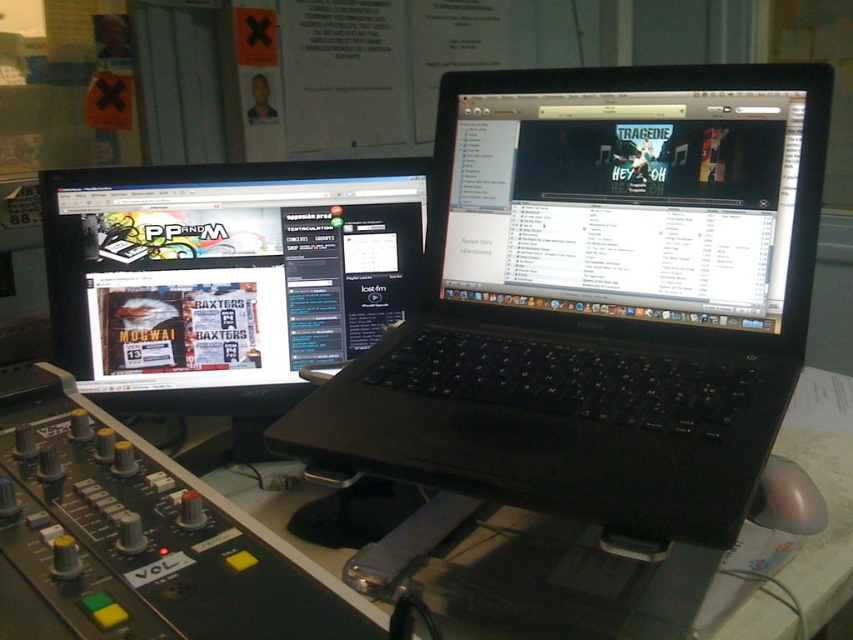
Is matte black monitor at left below black glossy laptop at upper center?

Indeed, matte black monitor at left is positioned under black glossy laptop at upper center.

The width and height of the screenshot is (853, 640). What do you see at coordinates (225, 275) in the screenshot? I see `matte black monitor at left` at bounding box center [225, 275].

Is point (408, 291) positioned in front of point (666, 253)?

No, (408, 291) is behind (666, 253).

Locate an element on the screen. This screenshot has height=640, width=853. matte black monitor at left is located at coordinates (225, 275).

Does black matte laptop at upper center have a larger size compared to matte black monitor at left?

Yes, black matte laptop at upper center is bigger than matte black monitor at left.

Is point (448, 400) positioned in front of point (212, 205)?

Yes.

This screenshot has height=640, width=853. What are the coordinates of `black matte laptop at upper center` in the screenshot? It's located at (599, 300).

Between black matte laptop at upper center and black glossy laptop at upper center, which one appears on the right side from the viewer's perspective?

black glossy laptop at upper center is more to the right.

Looking at this image, can you confirm if black matte laptop at upper center is positioned to the left of black glossy laptop at upper center?

Correct, you'll find black matte laptop at upper center to the left of black glossy laptop at upper center.

Is point (498, 145) positioned before point (485, 140)?

Yes, point (498, 145) is closer to viewer.

At what (x,y) coordinates should I click in order to perform the action: click on black matte laptop at upper center. Please return your answer as a coordinate pair (x, y). Image resolution: width=853 pixels, height=640 pixels. Looking at the image, I should click on 599,300.